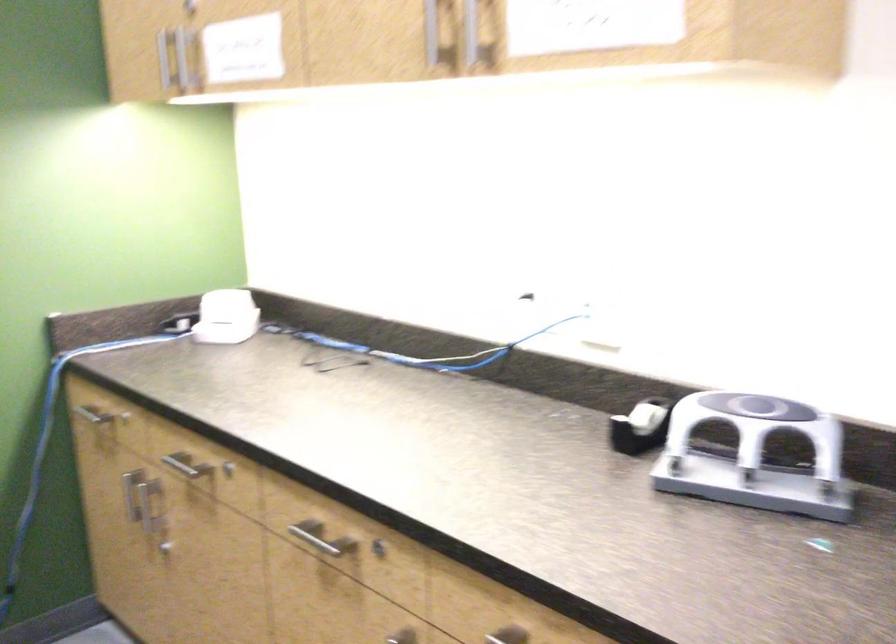
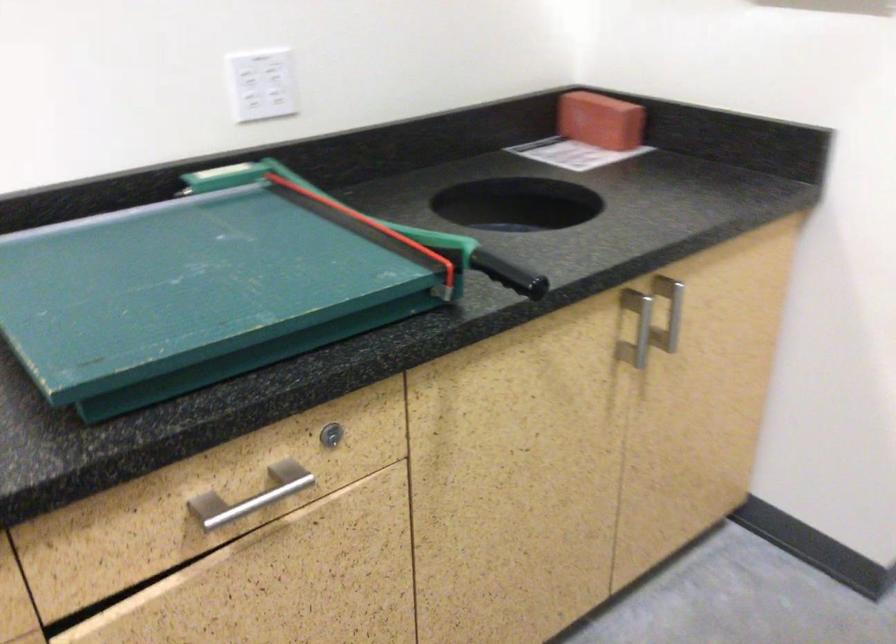
Based on the continuous images, in which direction is the camera rotating?

The camera's rotation is toward right-down.